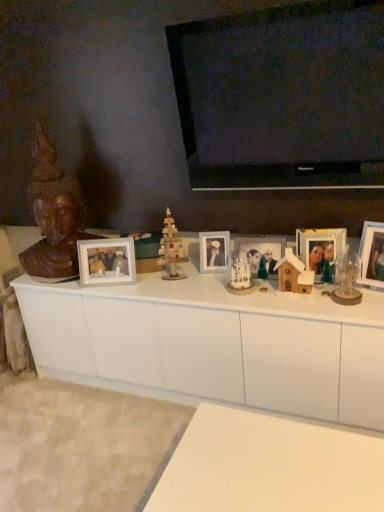
Where is `free spot in front of white wooden house at center, which is the first toy from right to left`? Image resolution: width=384 pixels, height=512 pixels. free spot in front of white wooden house at center, which is the first toy from right to left is located at coordinates (302, 305).